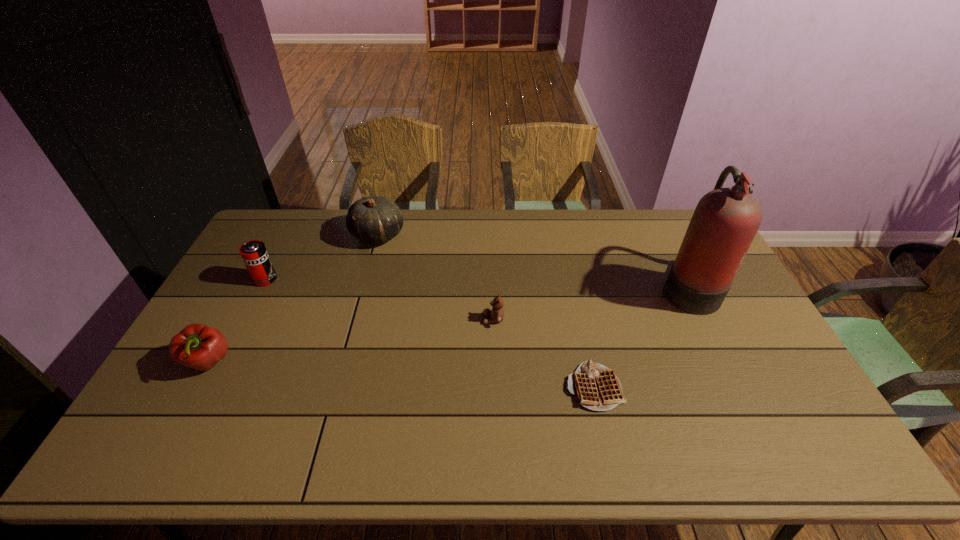
Find the location of `vacant region located 0.070m at the nozzle of the rightmost object`. vacant region located 0.070m at the nozzle of the rightmost object is located at coordinates (639, 287).

Where is `free space located 0.130m at the nozzle of the rightmost object`? The width and height of the screenshot is (960, 540). free space located 0.130m at the nozzle of the rightmost object is located at coordinates (621, 287).

The image size is (960, 540). Identify the location of blank area located 0.300m at the nozzle of the rightmost object. (569, 287).

Where is `vacant space located 0.350m on the left of the farthest object`? The width and height of the screenshot is (960, 540). vacant space located 0.350m on the left of the farthest object is located at coordinates (256, 235).

Locate an element on the screen. This screenshot has height=540, width=960. vacant space located on the front of the can is located at coordinates (228, 351).

At what (x,y) coordinates should I click in order to perform the action: click on free spot located 0.090m on the front of the bell pepper. Please return your answer as a coordinate pair (x, y). The width and height of the screenshot is (960, 540). Looking at the image, I should click on (181, 413).

Locate an element on the screen. The width and height of the screenshot is (960, 540). free region located 0.300m on the front-facing side of the teddy bear is located at coordinates (385, 319).

The width and height of the screenshot is (960, 540). I want to click on vacant area located 0.260m on the front-facing side of the teddy bear, so click(397, 319).

Where is `vacant space positioned on the front-facing side of the teddy bear`? vacant space positioned on the front-facing side of the teddy bear is located at coordinates pos(427,319).

Where is `blank space located 0.160m on the right of the waffle`? blank space located 0.160m on the right of the waffle is located at coordinates (683, 387).